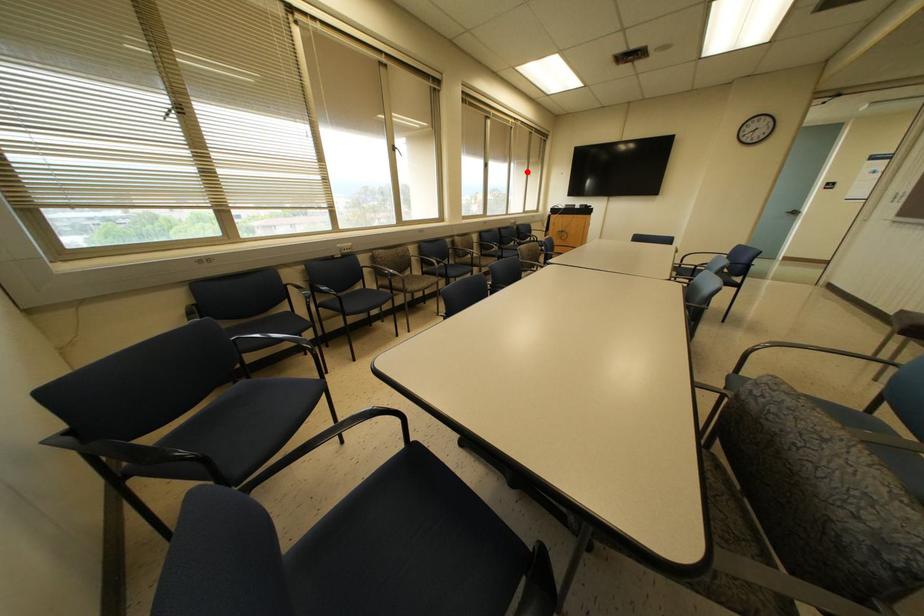
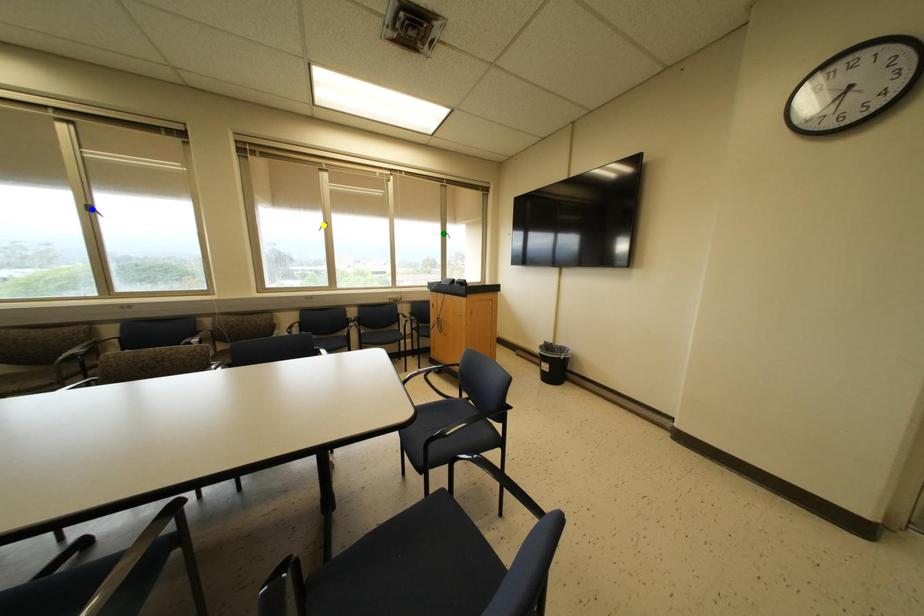
Question: I am providing you with two images of the same scene from different viewpoints. A red point is marked on the first image. You are given multiple points on the second image. Which point in image 2 represents the same 3d spot as the red point in image 1?

Choices:
 (A) yellow point
 (B) green point
 (C) blue point

Answer: (B)